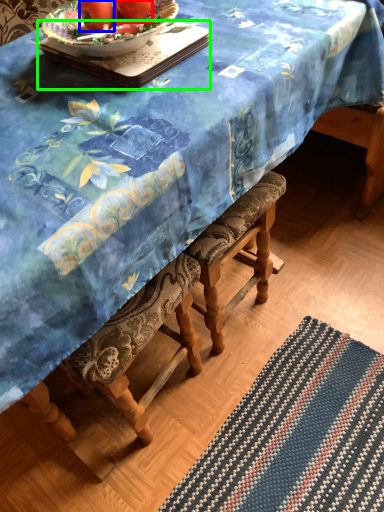
Question: Which object is positioned farthest from tomato (highlighted by a red box)? Select from tomato (highlighted by a blue box) and tray (highlighted by a green box).

Choices:
 (A) tomato
 (B) tray

Answer: (B)